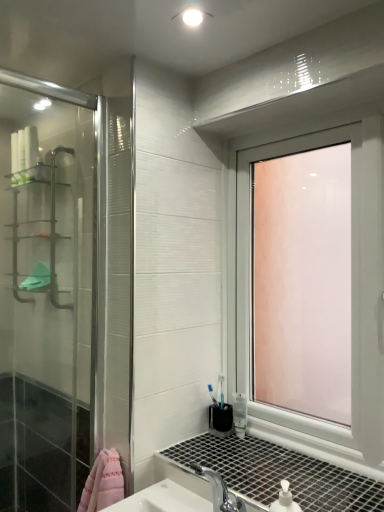
Question: Considering the positions of metallic silver shelf at left and transparent glass window at upper right in the image, is metallic silver shelf at left taller or shorter than transparent glass window at upper right?

Choices:
 (A) short
 (B) tall

Answer: (A)

Question: Looking at their shapes, would you say metallic silver shelf at left is wider or thinner than transparent glass window at upper right?

Choices:
 (A) wide
 (B) thin

Answer: (A)

Question: Is metallic silver shelf at left spatially inside transparent glass window at upper right, or outside of it?

Choices:
 (A) inside
 (B) outside

Answer: (B)

Question: Considering their positions, is transparent glass window at upper right located in front of or behind metallic silver shelf at left?

Choices:
 (A) behind
 (B) front

Answer: (B)

Question: Is transparent glass window at upper right bigger or smaller than metallic silver shelf at left?

Choices:
 (A) small
 (B) big

Answer: (B)

Question: From a real-world perspective, is transparent glass window at upper right physically located above or below metallic silver shelf at left?

Choices:
 (A) below
 (B) above

Answer: (A)

Question: Would you say transparent glass window at upper right is to the left or to the right of metallic silver shelf at left in the picture?

Choices:
 (A) right
 (B) left

Answer: (A)